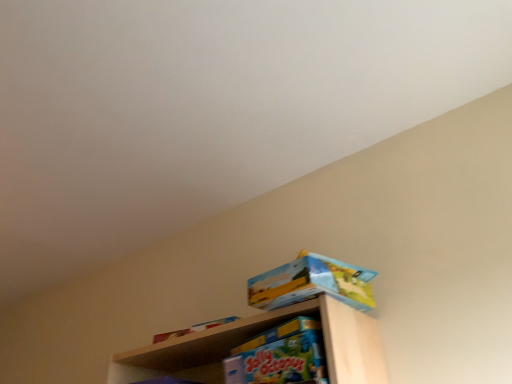
Question: Looking at the image, does matte cardboard box at upper right, which ranks as the first toy in top-to-bottom order, seem bigger or smaller compared to matte blue board game at center, which appears as the second toy when viewed from the top?

Choices:
 (A) small
 (B) big

Answer: (A)

Question: From a real-world perspective, is matte cardboard box at upper right, which appears as the 2th toy when ordered from the bottom, above or below matte blue board game at center, which appears as the second toy when viewed from the top?

Choices:
 (A) above
 (B) below

Answer: (A)

Question: From the image's perspective, is matte cardboard box at upper right, which ranks as the first toy in top-to-bottom order, above or below matte blue board game at center, which appears as the second toy when viewed from the top?

Choices:
 (A) above
 (B) below

Answer: (A)

Question: Does point (294, 334) appear closer or farther from the camera than point (276, 279)?

Choices:
 (A) farther
 (B) closer

Answer: (B)

Question: Is matte blue board game at center, which appears as the second toy when viewed from the top, wider or thinner than matte cardboard box at upper right, which ranks as the first toy in top-to-bottom order?

Choices:
 (A) thin
 (B) wide

Answer: (B)

Question: Based on their sizes in the image, would you say matte blue board game at center, acting as the first toy starting from the bottom, is bigger or smaller than matte cardboard box at upper right, which ranks as the first toy in top-to-bottom order?

Choices:
 (A) small
 (B) big

Answer: (B)

Question: Relative to matte cardboard box at upper right, which ranks as the first toy in top-to-bottom order, is matte blue board game at center, acting as the first toy starting from the bottom, in front or behind?

Choices:
 (A) behind
 (B) front

Answer: (B)